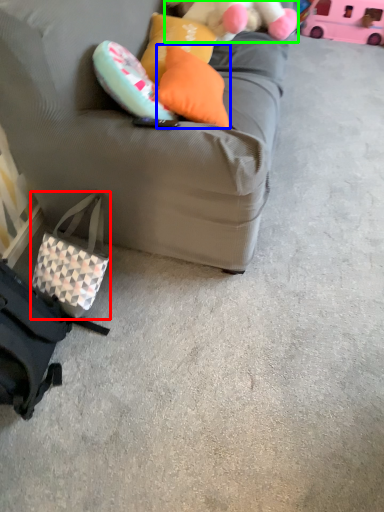
Question: Which is farther away from pouch (highlighted by a red box)? pillow (highlighted by a blue box) or teddy (highlighted by a green box)?

Choices:
 (A) pillow
 (B) teddy

Answer: (B)